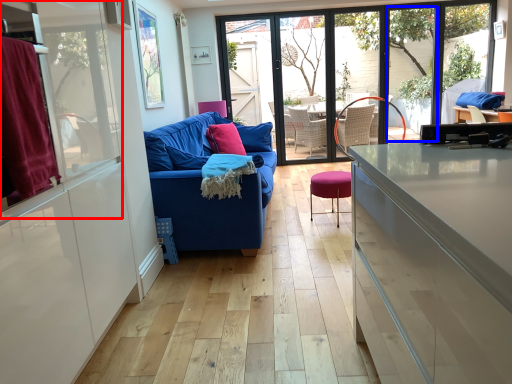
Question: Which of the following is the closest to the observer, window screen (highlighted by a red box) or window (highlighted by a blue box)?

Choices:
 (A) window screen
 (B) window

Answer: (A)